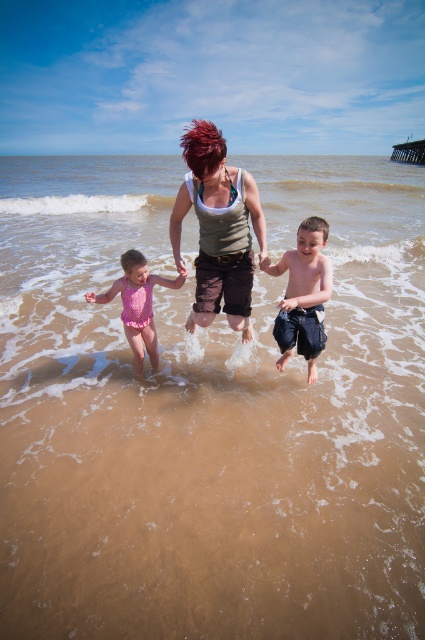
Question: From the image, what is the correct spatial relationship of matte gray tank top at center in relation to pink matte swimsuit at center?

Choices:
 (A) above
 (B) below

Answer: (A)

Question: Is the position of matte gray tank top at center less distant than that of blue denim shorts at center?

Choices:
 (A) no
 (B) yes

Answer: (B)

Question: Is matte gray tank top at center thinner than blue denim shorts at center?

Choices:
 (A) no
 (B) yes

Answer: (B)

Question: Which point is farther to the camera?

Choices:
 (A) matte gray tank top at center
 (B) pink matte swimsuit at center
 (C) blue denim shorts at center

Answer: (B)

Question: Which object is closer to the camera taking this photo?

Choices:
 (A) matte gray tank top at center
 (B) blue denim shorts at center
 (C) pink matte swimsuit at center

Answer: (A)

Question: Which object is positioned farthest from the pink matte swimsuit at center?

Choices:
 (A) blue denim shorts at center
 (B) matte gray tank top at center

Answer: (B)